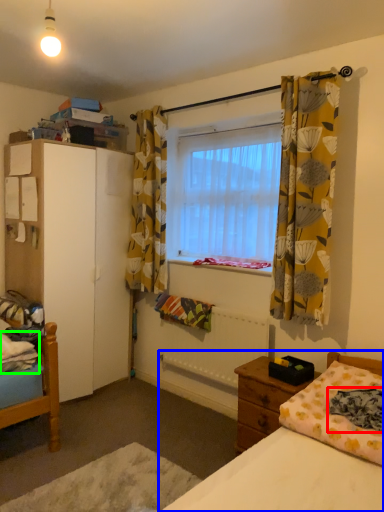
Question: Estimate the real-world distances between objects in this image. Which object is farther from blanket (highlighted by a red box), bed (highlighted by a blue box) or sheet (highlighted by a green box)?

Choices:
 (A) bed
 (B) sheet

Answer: (B)